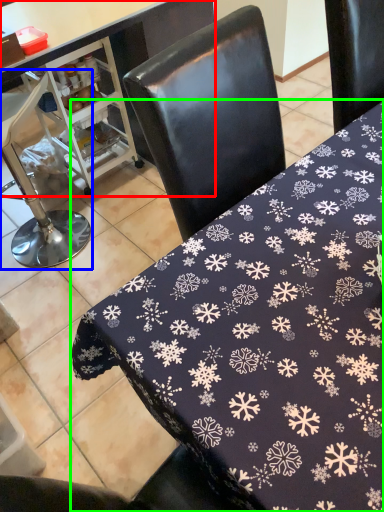
Question: Which object is positioned closest to table (highlighted by a red box)? Select from chair (highlighted by a blue box) and table (highlighted by a green box).

Choices:
 (A) chair
 (B) table

Answer: (A)